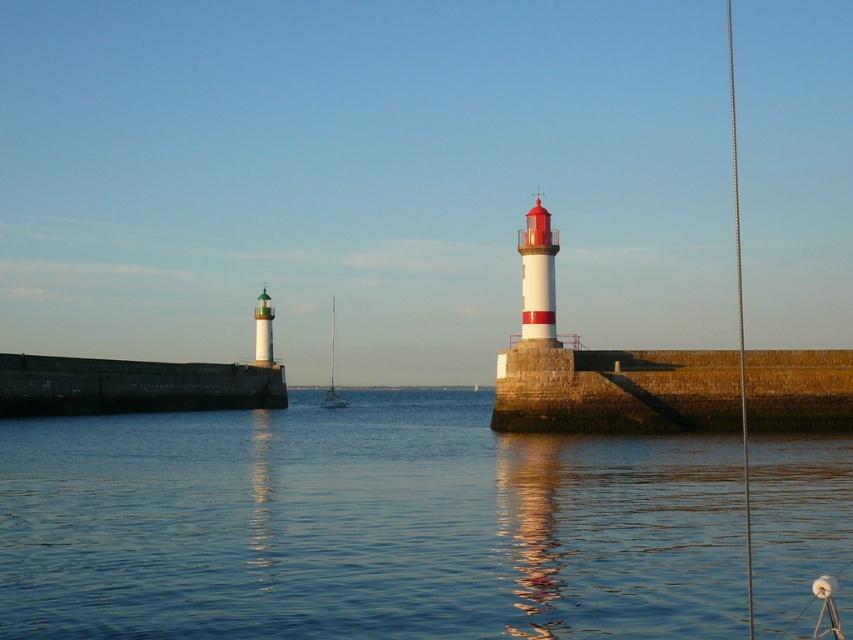
Is point (357, 413) in front of point (747, 595)?

No, it is not.

Which is more to the left, transparent water at center or metallic wire at right?

Positioned to the left is transparent water at center.

Image resolution: width=853 pixels, height=640 pixels. In order to click on transparent water at center in this screenshot , I will do `click(364, 525)`.

Which of these two, transparent water at center or brown stone wall at right, stands taller?

brown stone wall at right is taller.

Can you confirm if transparent water at center is shorter than brown stone wall at right?

Yes.

Does point (601, 600) lie in front of point (631, 397)?

Yes, point (601, 600) is in front of point (631, 397).

Find the location of a particular element. The width and height of the screenshot is (853, 640). transparent water at center is located at coordinates (364, 525).

This screenshot has width=853, height=640. What do you see at coordinates (740, 324) in the screenshot?
I see `metallic wire at right` at bounding box center [740, 324].

Is point (728, 28) in front of point (343, 404)?

No.

Who is more forward, (730,13) or (337,400)?

Point (337,400)

Identify the location of metallic wire at right. The height and width of the screenshot is (640, 853). coord(740,324).